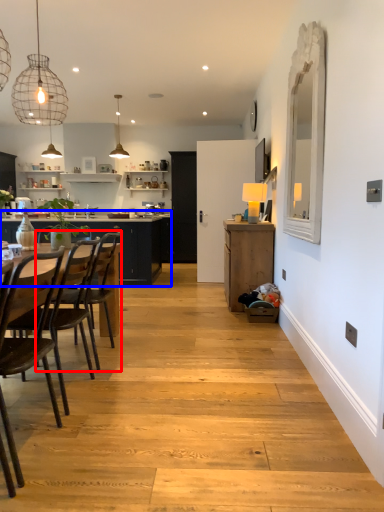
Question: Which object is further to the camera taking this photo, chair (highlighted by a red box) or countertop (highlighted by a blue box)?

Choices:
 (A) chair
 (B) countertop

Answer: (B)